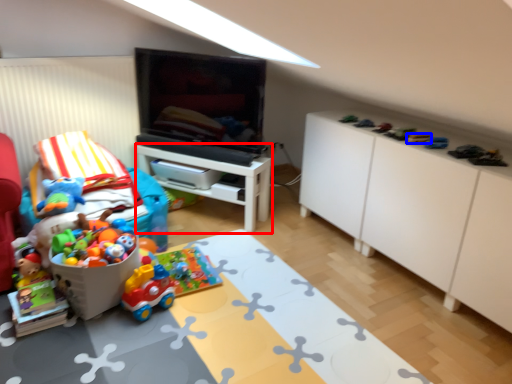
Question: Which object appears closest to the camera in this image, table (highlighted by a red box) or toy (highlighted by a blue box)?

Choices:
 (A) table
 (B) toy

Answer: (B)